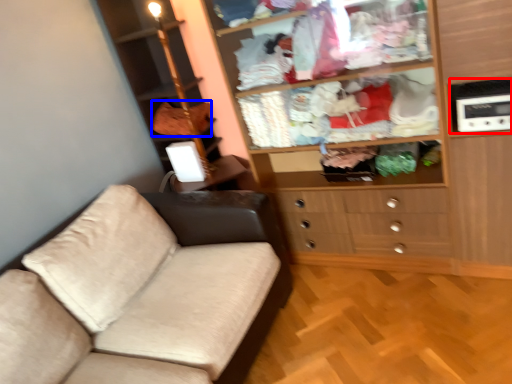
Question: Which point is closer to the camera, appliance (highlighted by a red box) or clothing (highlighted by a blue box)?

Choices:
 (A) appliance
 (B) clothing

Answer: (A)